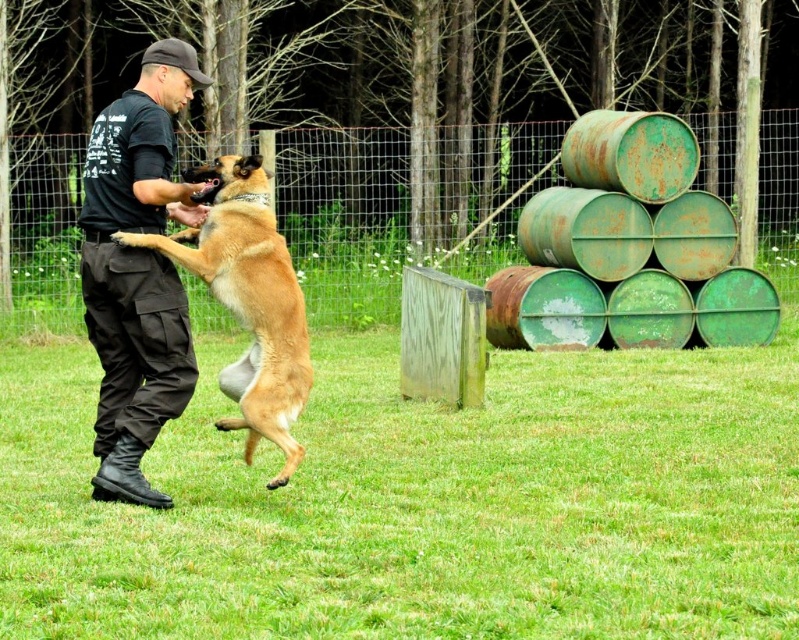
Question: Which point is farther to the camera?

Choices:
 (A) (116, 424)
 (B) (559, 211)
 (C) (221, 182)

Answer: (B)

Question: Is rusty green barrel at right further to camera compared to black cotton shirt at center?

Choices:
 (A) no
 (B) yes

Answer: (B)

Question: Estimate the real-world distances between objects in this image. Which object is farther from the black cotton shirt at center?

Choices:
 (A) furry golden dog at center
 (B) rusty green barrel at right

Answer: (B)

Question: Which object is closer to the camera taking this photo?

Choices:
 (A) rusty green barrel at right
 (B) black cotton shirt at center

Answer: (B)

Question: Observing the image, what is the correct spatial positioning of rusty green barrel at right in reference to black cotton shirt at center?

Choices:
 (A) below
 (B) above

Answer: (B)

Question: Is rusty green barrel at right thinner than black cotton shirt at center?

Choices:
 (A) no
 (B) yes

Answer: (A)